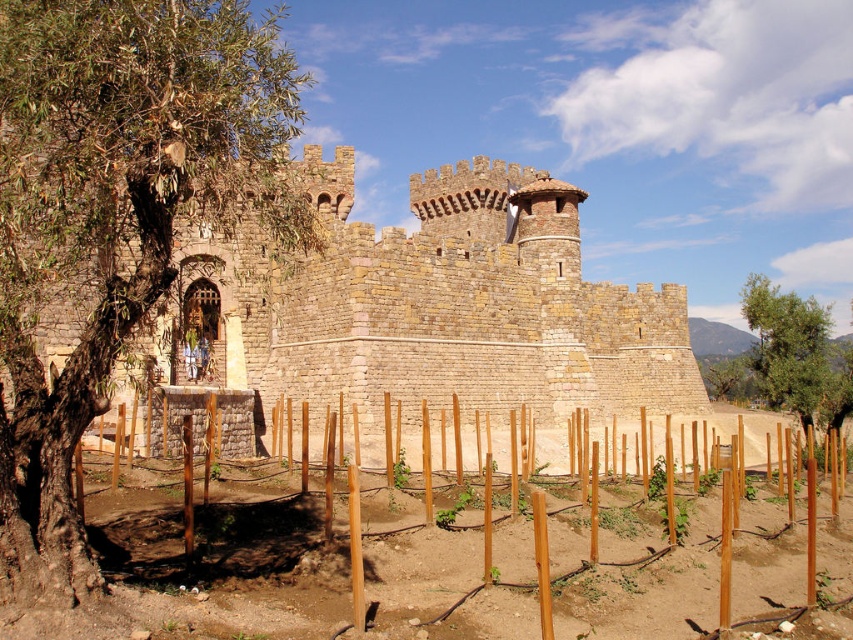
You are a knight standing in the garden in front of the rustic stone castle at center. You want to reach the green leafy tree at right to retrieve an apple. Which direction should you move to get there?

The rustic stone castle at center is to the left of green leafy tree at right, so you should move to the right to reach the green leafy tree at right.

You are a gardener who wants to plant a new row of vegetables between the brown wooden stakes at lower center and the green leafy tree at right. Given that each vegetable plant requires 30 centimeters of space, how many plants can you fit in a straight line between them?

The distance between the brown wooden stakes at lower center and the green leafy tree at right is 60.74 meters. Converting this to centimeters gives 6074 cm. Dividing by the required 30 cm per plant yields approximately 202 plants. However, since you can only plant whole numbers, you can fit 202 plants in a straight line between them.